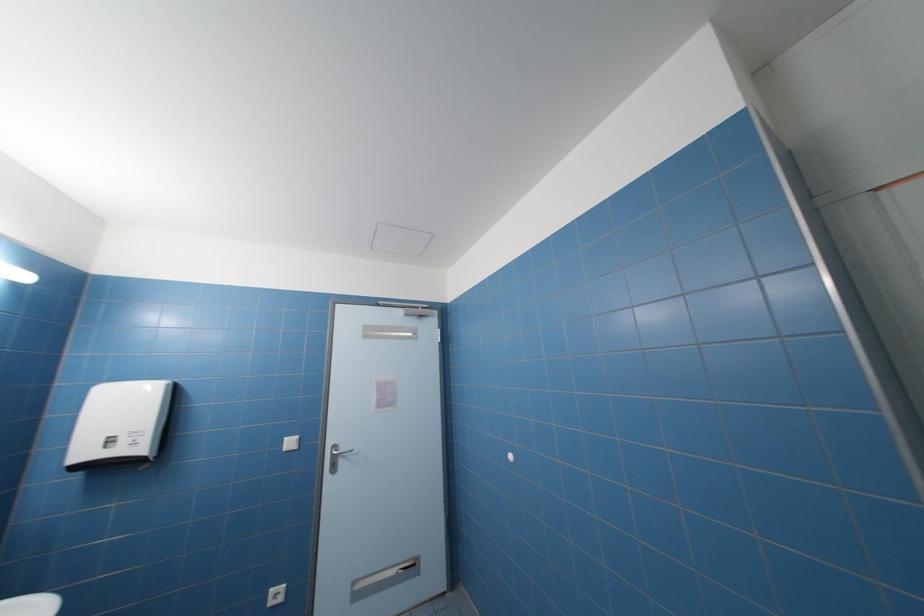
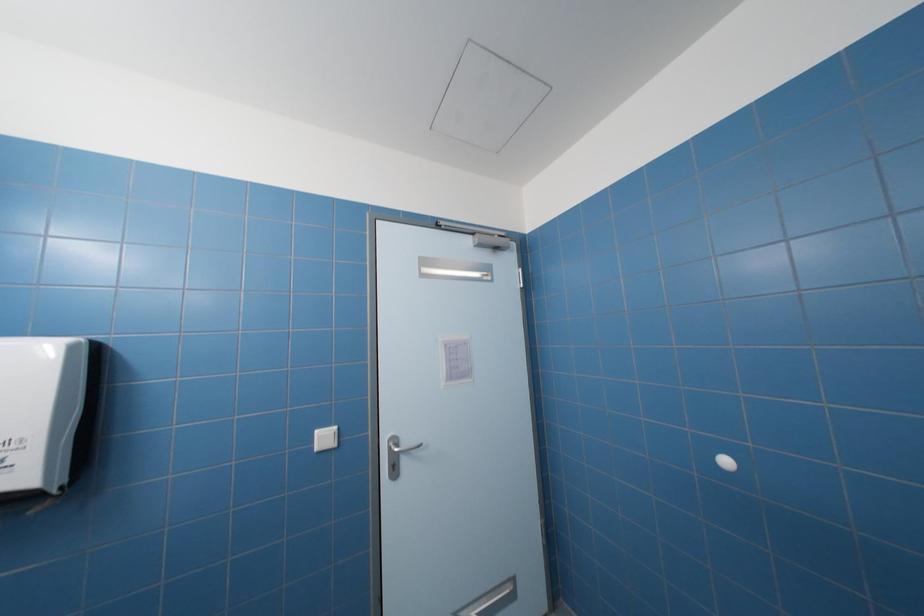
Question: The images are taken continuously from a first-person perspective. In which direction is your viewpoint rotating?

Choices:
 (A) Left
 (B) Right
 (C) Up
 (D) Down

Answer: (D)